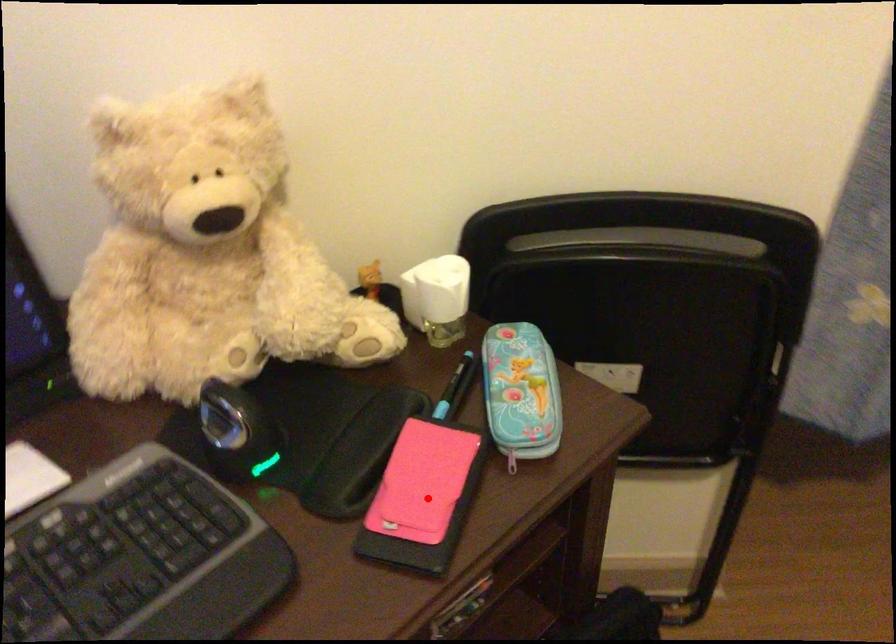
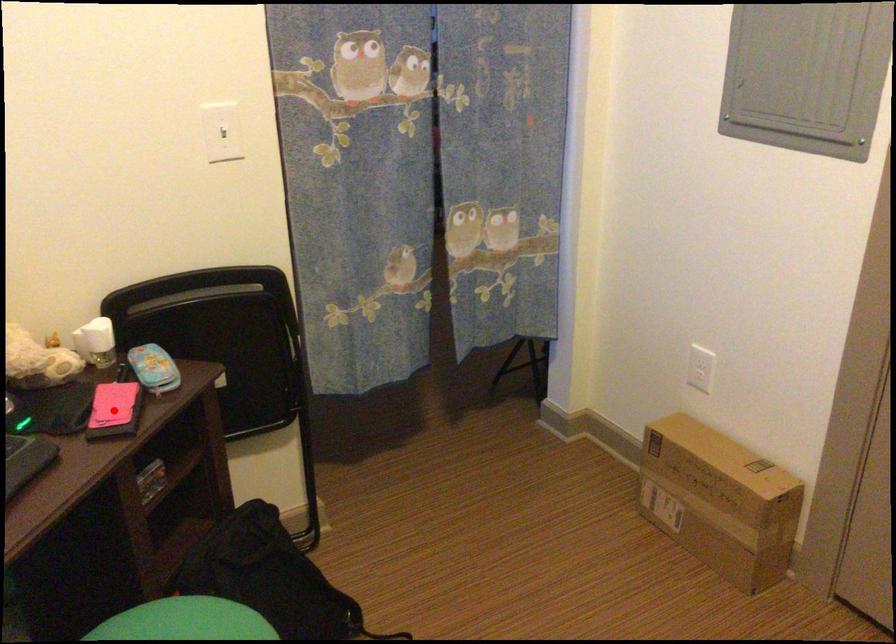
I am providing you with two images of the same scene from different viewpoints. A red point is marked on the first image and another point is marked on the second image. Do the highlighted points in image1 and image2 indicate the same real-world spot?

Yes